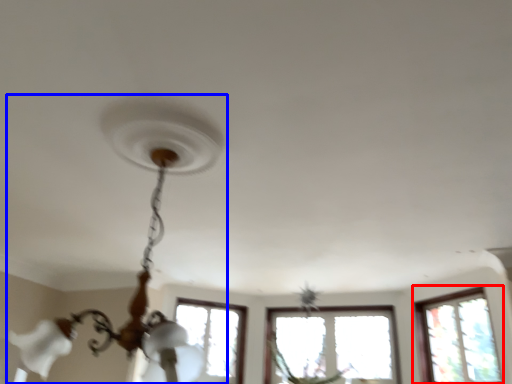
Question: Which object is closer to the camera taking this photo, window (highlighted by a red box) or lamp (highlighted by a blue box)?

Choices:
 (A) window
 (B) lamp

Answer: (B)